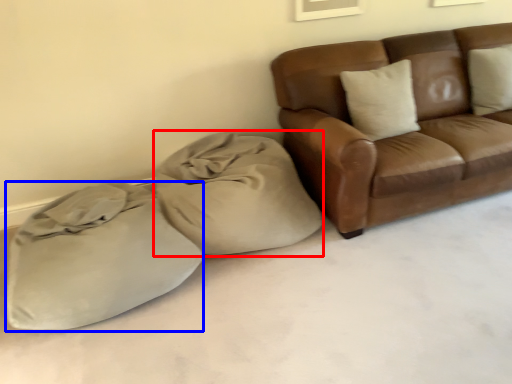
Question: Which point is further to the camera, bean bag chair (highlighted by a red box) or sack (highlighted by a blue box)?

Choices:
 (A) bean bag chair
 (B) sack

Answer: (A)